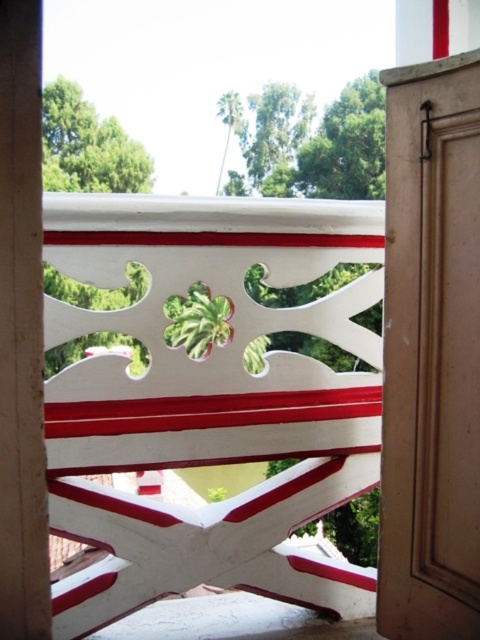
You are standing in front of the decorative railing and want to locate the matte brown door at right. According to the coordinates provided, where should you look relative to the railing?

The matte brown door at right is located at coordinates point 0.553 on the x axis and 0.898 on the y axis relative to the railing.

You are standing in front of a railing with a matte brown door at right and a wooden at left. Which object is located higher up?

The matte brown door at right is positioned over the wooden at left, so it is higher up.